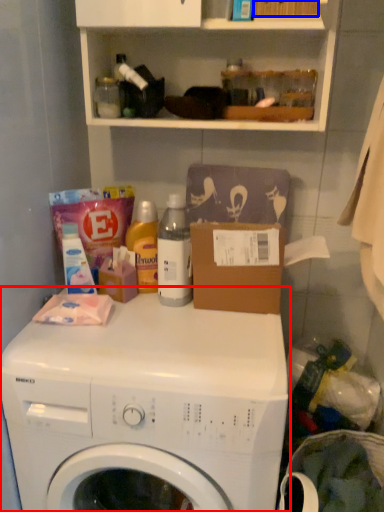
Question: Which of the following is the farthest to the observer, washing machine (highlighted by a red box) or box (highlighted by a blue box)?

Choices:
 (A) washing machine
 (B) box

Answer: (B)